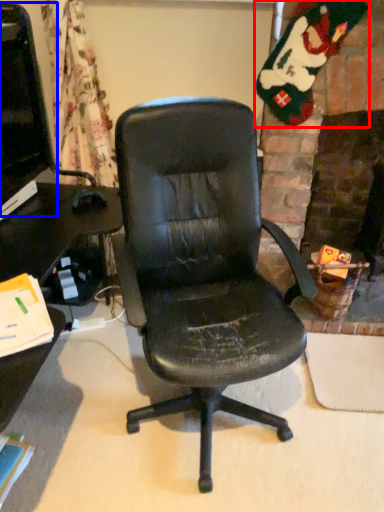
Question: Which of the following is the closest to the observer, santa claus (highlighted by a red box) or computer monitor (highlighted by a blue box)?

Choices:
 (A) santa claus
 (B) computer monitor

Answer: (B)